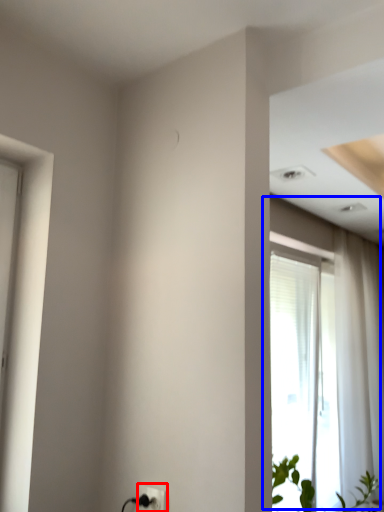
Question: Which object appears farthest to the camera in this image, electric outlet (highlighted by a red box) or window (highlighted by a blue box)?

Choices:
 (A) electric outlet
 (B) window

Answer: (B)